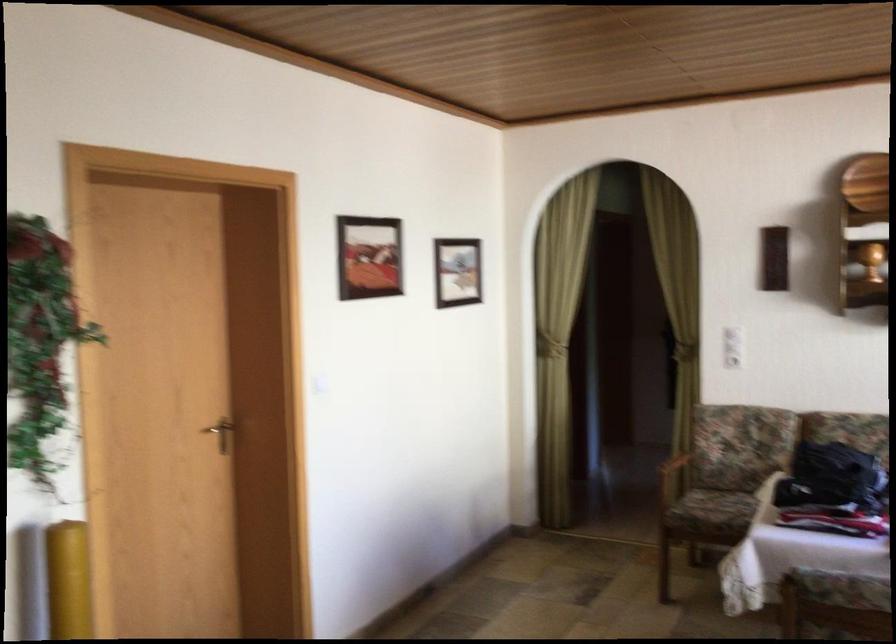
Where is `metal door handle`? Image resolution: width=896 pixels, height=644 pixels. metal door handle is located at coordinates (225, 433).